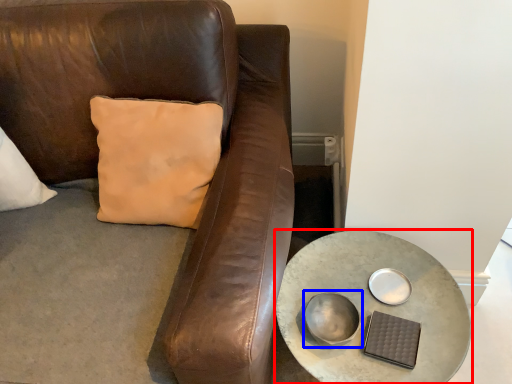
Question: Which point is closer to the camera, table (highlighted by a red box) or bowl (highlighted by a blue box)?

Choices:
 (A) table
 (B) bowl

Answer: (A)